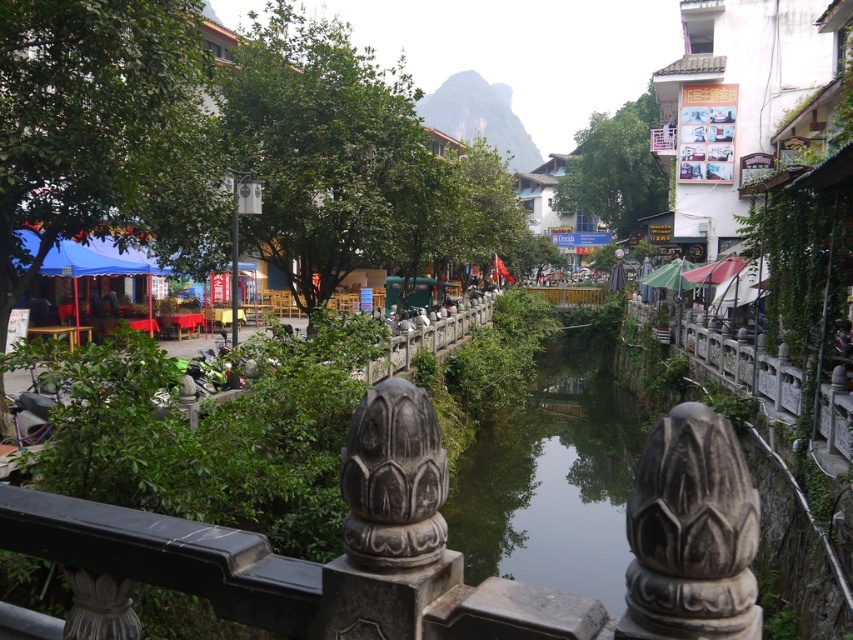
Where is `gray stone sculpture at center`? The height and width of the screenshot is (640, 853). gray stone sculpture at center is located at coordinates (691, 532).

Is point (666, 579) closer to camera compared to point (352, 452)?

Yes, point (666, 579) is closer to viewer.

Locate an element on the screen. gray stone sculpture at center is located at coordinates (691, 532).